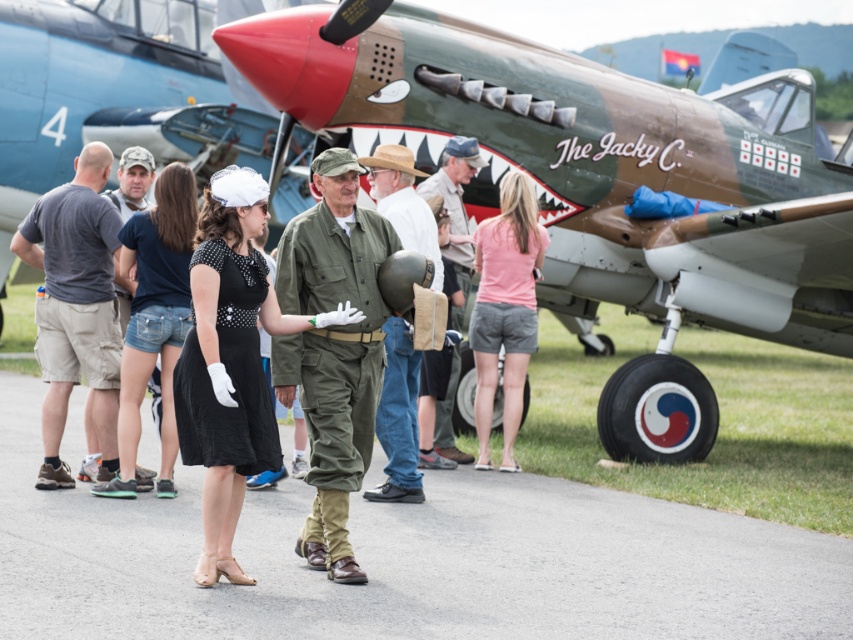
You are a photographer at the event and want to capture both the green fabric uniform at center and the black satin dress at center in a single photo. However, your camera can only focus on one subject at a time. Which clothing item should you focus on to ensure the other appears in the background?

You should focus on the green fabric uniform at center because it is positioned over the black satin dress at center, meaning the dress will be in the background.

You are a photographer standing at the edge of the airshow field, and you want to take a photo of the camouflage paint airplane at center. If you are currently 100 feet away from the airplane, how many more feet do you need to walk forward to get within 33.33 feet of it?

You are currently 100 feet away from the camouflage paint airplane at center. To get within 33.33 feet of it, you need to walk forward 66.67 feet. This is calculated by subtracting the desired distance from the current distance.